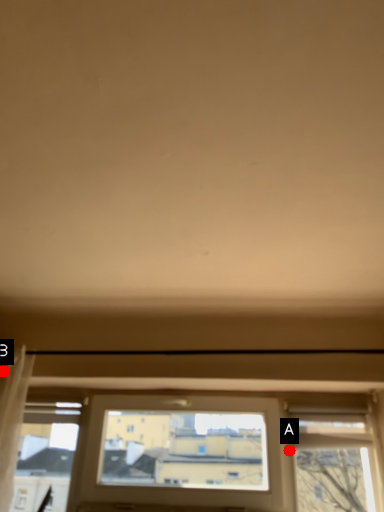
Question: Two points are circled on the image, labeled by A and B beside each circle. Which point is closer to the camera?

Choices:
 (A) A is closer
 (B) B is closer

Answer: (B)